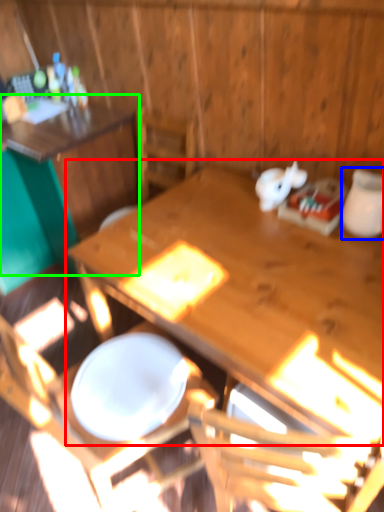
Question: Which object is positioned closest to table (highlighted by a red box)? Select from tableware (highlighted by a blue box) and table (highlighted by a green box).

Choices:
 (A) tableware
 (B) table

Answer: (A)